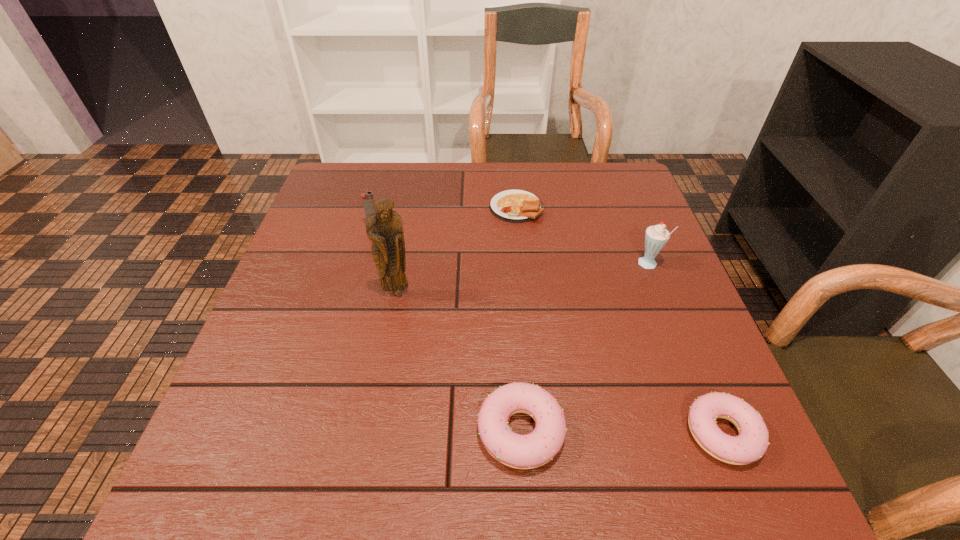
Locate an element on the screen. The height and width of the screenshot is (540, 960). the fourth farthest object is located at coordinates (384, 228).

Find the location of a particular element. Image resolution: width=960 pixels, height=540 pixels. free space located 0.180m on the left of the taller doughnut is located at coordinates (372, 431).

Locate an element on the screen. The width and height of the screenshot is (960, 540). vacant space located on the left of the right doughnut is located at coordinates (598, 433).

The width and height of the screenshot is (960, 540). What are the coordinates of `vacant space located 0.330m on the left of the shortest object` in the screenshot? It's located at (370, 207).

This screenshot has width=960, height=540. Find the location of `blank space located on the right of the leftmost object`. blank space located on the right of the leftmost object is located at coordinates (444, 226).

Identify the location of free location located on the straw side of the milkshake. The height and width of the screenshot is (540, 960). (524, 266).

The height and width of the screenshot is (540, 960). Identify the location of free space located on the straw side of the milkshake. (616, 266).

Find the location of a particular element. vacant region located on the straw side of the milkshake is located at coordinates (537, 266).

You are a GUI agent. You are given a task and a screenshot of the screen. Output one action in this format:
    pyautogui.click(x=<x>, y=<y>)
    Task: Click on the free space located on the front-facing side of the fourth farthest object
    The height and width of the screenshot is (540, 960).
    Given the screenshot: What is the action you would take?
    pyautogui.click(x=383, y=368)

You are a GUI agent. You are given a task and a screenshot of the screen. Output one action in this format:
    pyautogui.click(x=<x>, y=<y>)
    Task: Click on the object that is positioned at the far edge
    
    Given the screenshot: What is the action you would take?
    pyautogui.click(x=513, y=205)